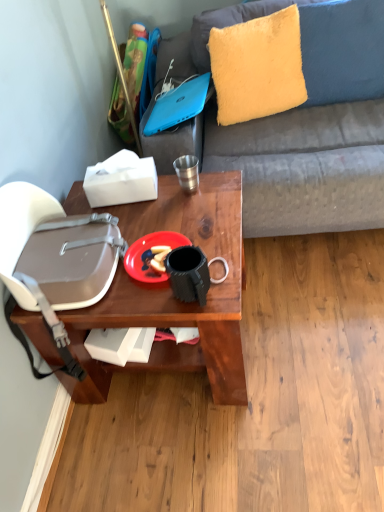
You are a GUI agent. You are given a task and a screenshot of the screen. Output one action in this format:
    pyautogui.click(x=<x>, y=<y>)
    Task: Click on the vacant area on top of plastic matte plate at center (from a real-world perspective)
    This screenshot has width=384, height=512.
    Given the screenshot: What is the action you would take?
    pyautogui.click(x=153, y=251)